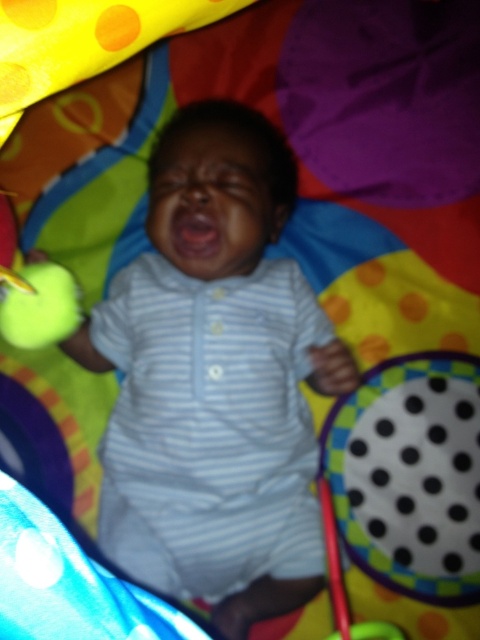
Is white striped onesie at center in front of green rubber ball at left?

Yes, white striped onesie at center is in front of green rubber ball at left.

Where is `white striped onesie at center`? white striped onesie at center is located at coordinates (215, 376).

This screenshot has width=480, height=640. Find the location of `white striped onesie at center`. white striped onesie at center is located at coordinates (215, 376).

At what (x,y) coordinates should I click in order to perform the action: click on white striped onesie at center. Please return your answer as a coordinate pair (x, y). Looking at the image, I should click on (215, 376).